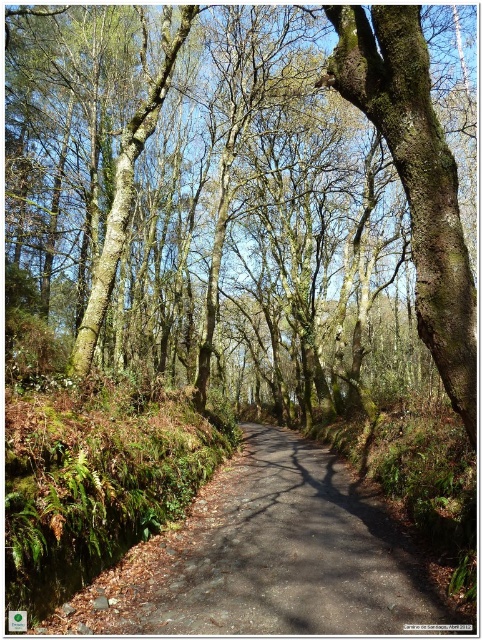
Question: Does dark gray asphalt road at center have a greater width compared to green mossy bark tree at center?

Choices:
 (A) yes
 (B) no

Answer: (A)

Question: Can you confirm if rough bark tree at center is positioned above green mossy bark tree at center?

Choices:
 (A) yes
 (B) no

Answer: (A)

Question: Which object is closer to the camera taking this photo?

Choices:
 (A) rough bark tree at center
 (B) dark gray asphalt road at center
 (C) green mossy bark tree at center

Answer: (B)

Question: Which point is farther to the camera?

Choices:
 (A) (331, 502)
 (B) (423, 154)
 (C) (359, 353)

Answer: (C)

Question: Which of the following is the farthest from the observer?

Choices:
 (A) (462, 380)
 (B) (168, 577)

Answer: (B)

Question: Does rough bark tree at center have a larger size compared to green mossy bark tree at center?

Choices:
 (A) no
 (B) yes

Answer: (B)